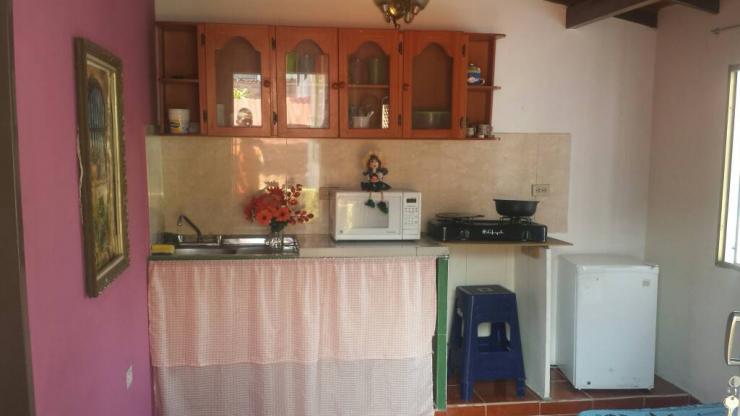
Identify the location of side wall. This screenshot has width=740, height=416. (52, 225).